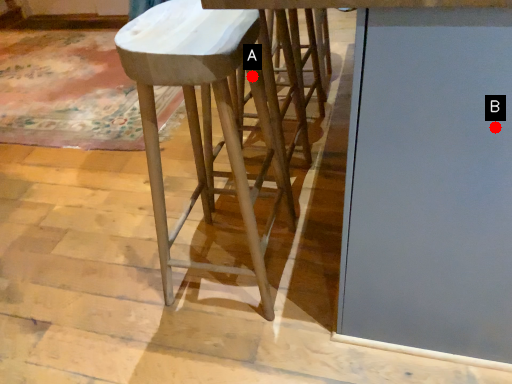
Question: Two points are circled on the image, labeled by A and B beside each circle. Which point is closer to the camera?

Choices:
 (A) A is closer
 (B) B is closer

Answer: (B)